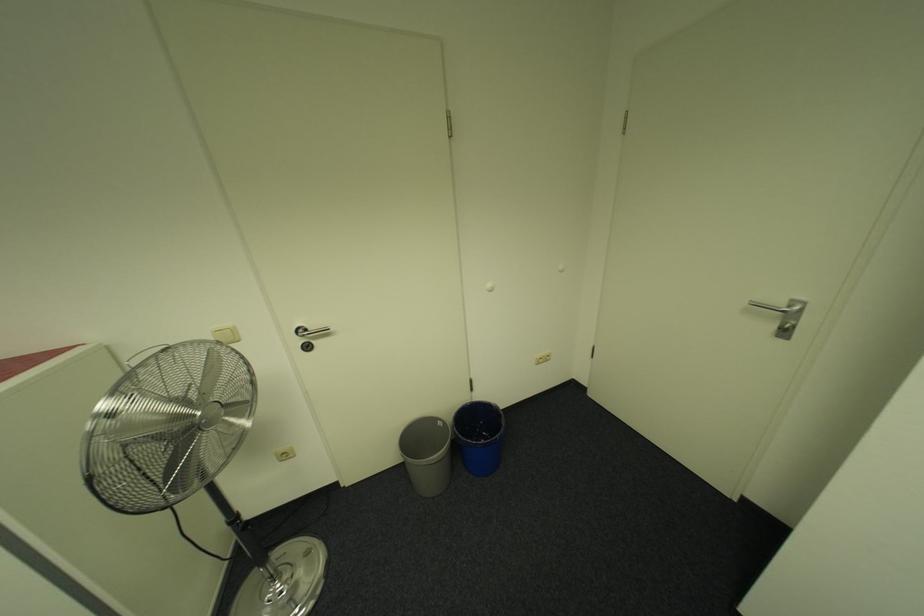
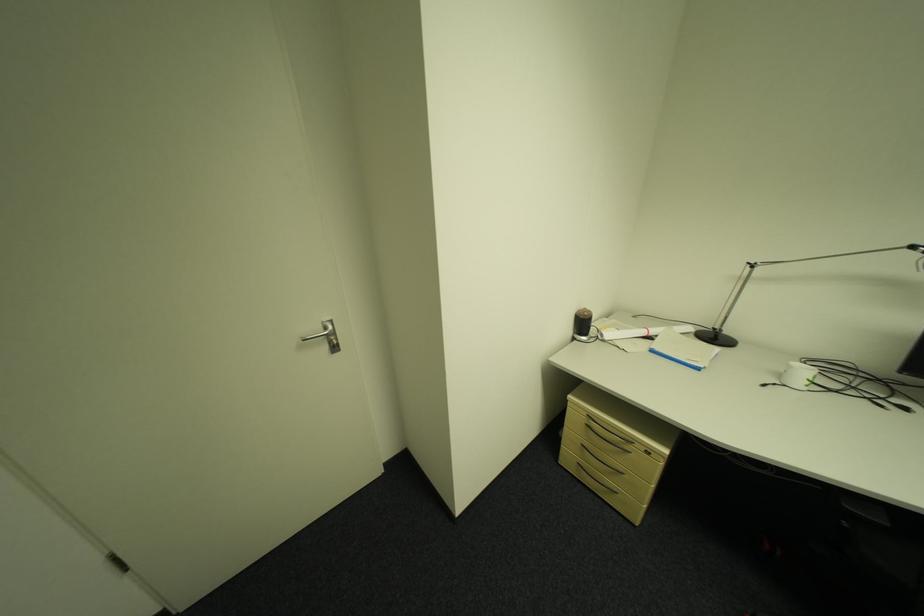
The images are taken continuously from a first-person perspective. In which direction is your viewpoint rotating?

The rotation direction of the camera is right-down.